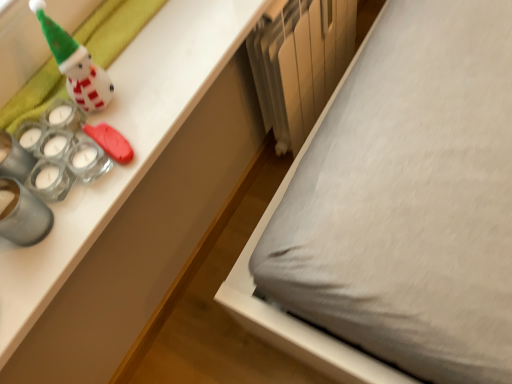
The height and width of the screenshot is (384, 512). In order to click on vacant area that lies to the right of white glossy snowman at upper left in this screenshot , I will do `click(170, 66)`.